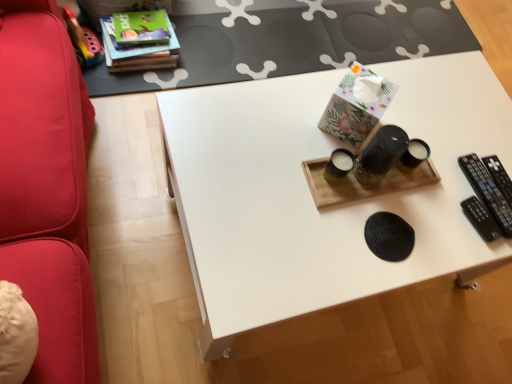
Question: Considering the positions of white matte tray at center and black plastic remote at right in the image, is white matte tray at center taller or shorter than black plastic remote at right?

Choices:
 (A) tall
 (B) short

Answer: (A)

Question: From a real-world perspective, is white matte tray at center physically located above or below black plastic remote at right?

Choices:
 (A) below
 (B) above

Answer: (A)

Question: Which object is positioned farthest from the hardcover book at upper left?

Choices:
 (A) white matte tray at center
 (B) white matte table at upper center
 (C) black plastic remote at right

Answer: (C)

Question: Estimate the real-world distances between objects in this image. Which object is closer to the hardcover book at upper left?

Choices:
 (A) white matte tray at center
 (B) black plastic remote at right
 (C) white matte table at upper center

Answer: (C)